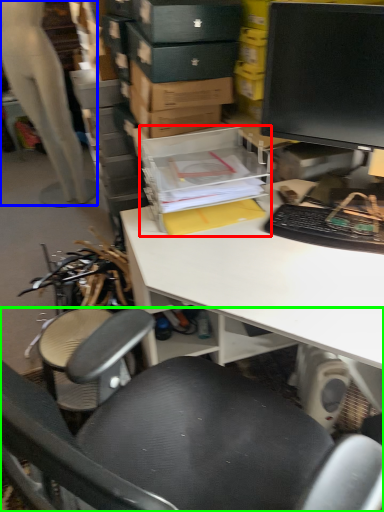
Question: Estimate the real-world distances between objects in this image. Which object is farther from storage box (highlighted by a red box), person (highlighted by a blue box) or chair (highlighted by a green box)?

Choices:
 (A) person
 (B) chair

Answer: (A)